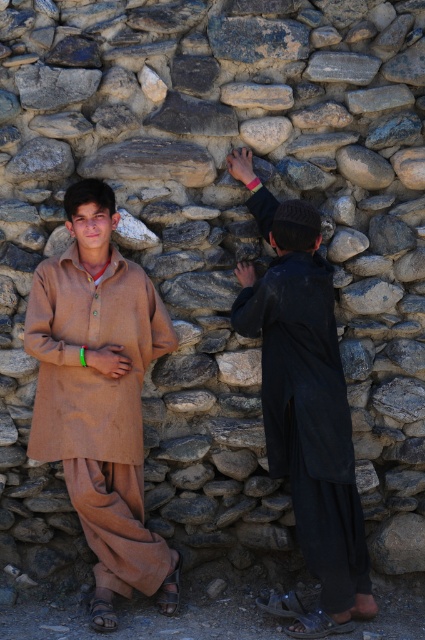
How far apart are matte brown kurta at center and black matte clothing at right?

A distance of 28.51 inches exists between matte brown kurta at center and black matte clothing at right.

Does matte brown kurta at center appear over black matte clothing at right?

No, matte brown kurta at center is not above black matte clothing at right.

Is point (110, 205) closer to viewer compared to point (246, 173)?

Yes.

The image size is (425, 640). Find the location of `matte brown kurta at center`. matte brown kurta at center is located at coordinates (99, 396).